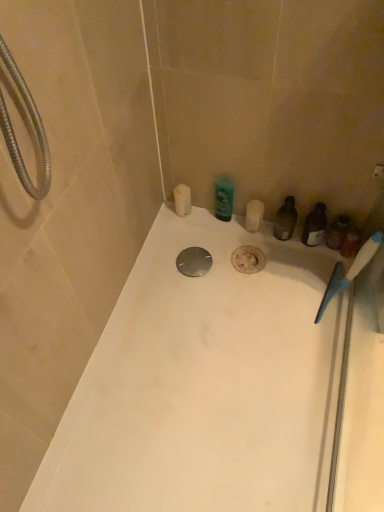
Where is `vacant space to the left of translucent plastic bottle at right`? The height and width of the screenshot is (512, 384). vacant space to the left of translucent plastic bottle at right is located at coordinates (230, 247).